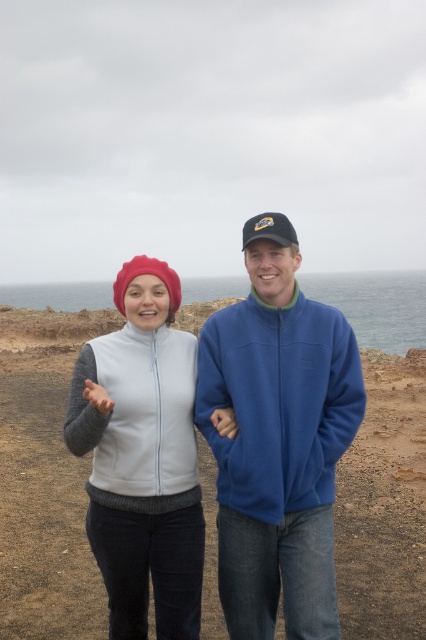
Can you confirm if smooth sand at center is positioned below white fleece vest at center?

Yes.

Does smooth sand at center appear over white fleece vest at center?

Actually, smooth sand at center is below white fleece vest at center.

Which is in front, point (31, 342) or point (134, 428)?

Point (134, 428) is in front.

The width and height of the screenshot is (426, 640). What are the coordinates of `smooth sand at center` in the screenshot? It's located at (45, 481).

Who is lower down, matte white vest at center or white fleece vest at center?

matte white vest at center is lower down.

Which is more to the left, matte white vest at center or white fleece vest at center?

Positioned to the left is white fleece vest at center.

Between point (166, 400) and point (195, 476), which one is positioned in front?

Point (166, 400) is in front.

At what (x,y) coordinates should I click in order to perform the action: click on matte white vest at center. Please return your answer as a coordinate pair (x, y). Looking at the image, I should click on (141, 456).

Is smooth sand at center closer to camera compared to matte white vest at center?

That is False.

Is smooth sand at center thinner than matte white vest at center?

No, smooth sand at center is not thinner than matte white vest at center.

This screenshot has width=426, height=640. I want to click on smooth sand at center, so click(x=45, y=481).

You are a GUI agent. You are given a task and a screenshot of the screen. Output one action in this format:
    pyautogui.click(x=<x>, y=<y>)
    Task: Click on the smooth sand at center
    The height and width of the screenshot is (640, 426).
    Given the screenshot: What is the action you would take?
    pyautogui.click(x=45, y=481)